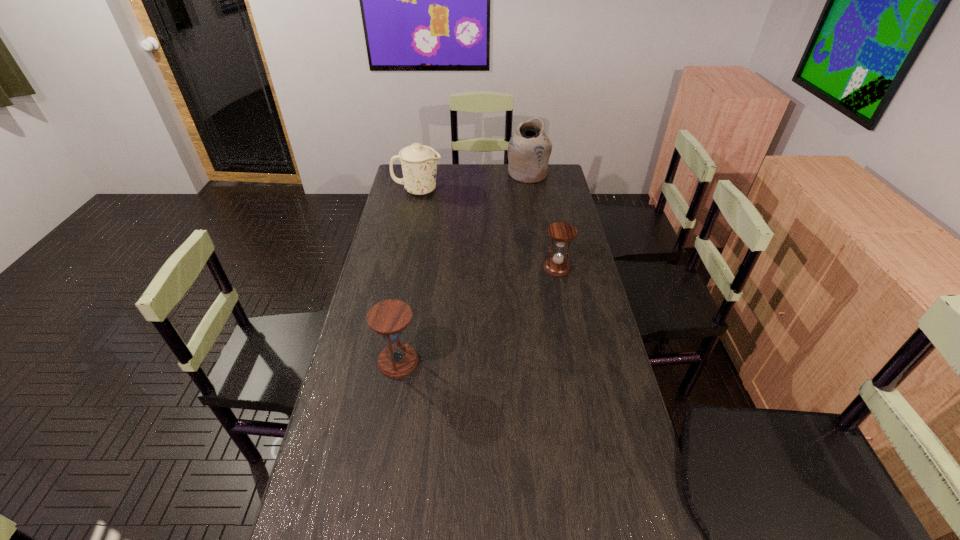
At what (x,y) coordinates should I click in order to perform the action: click on pottery. Please return your answer as a coordinate pair (x, y). Looking at the image, I should click on (529, 149).

Where is `chinaware`? chinaware is located at coordinates (419, 162).

Image resolution: width=960 pixels, height=540 pixels. In order to click on the left hourglass in this screenshot , I will do `click(389, 318)`.

You are a GUI agent. You are given a task and a screenshot of the screen. Output one action in this format:
    pyautogui.click(x=<x>, y=<y>)
    Task: Click on the nearest object
    Image resolution: width=960 pixels, height=540 pixels.
    Given the screenshot: What is the action you would take?
    pyautogui.click(x=389, y=318)

Identify the location of the shortest object. (557, 266).

At what (x,y) coordinates should I click in order to perform the action: click on the farther hourglass. Please return your answer as a coordinate pair (x, y). The height and width of the screenshot is (540, 960). Looking at the image, I should click on (557, 266).

Where is `vacant space located on the left of the pottery`? This screenshot has width=960, height=540. vacant space located on the left of the pottery is located at coordinates (448, 174).

This screenshot has height=540, width=960. I want to click on vacant space situated on the spout of the chinaware, so click(511, 191).

This screenshot has height=540, width=960. What are the coordinates of `free space located on the right of the left hourglass` in the screenshot? It's located at (511, 361).

Where is `vacant area located 0.240m on the front of the shorter hourglass`? This screenshot has width=960, height=540. vacant area located 0.240m on the front of the shorter hourglass is located at coordinates (568, 326).